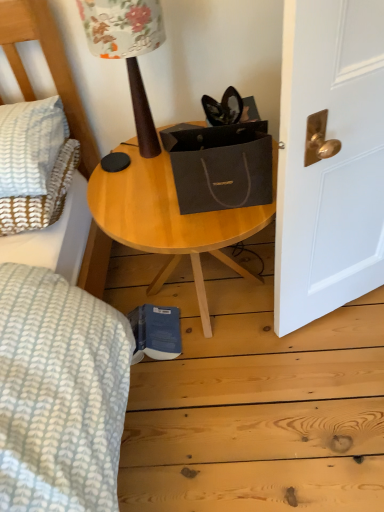
Where is `vacant space underneath wooden table lamp at upper center (from a real-world perspective)`? vacant space underneath wooden table lamp at upper center (from a real-world perspective) is located at coordinates (146, 158).